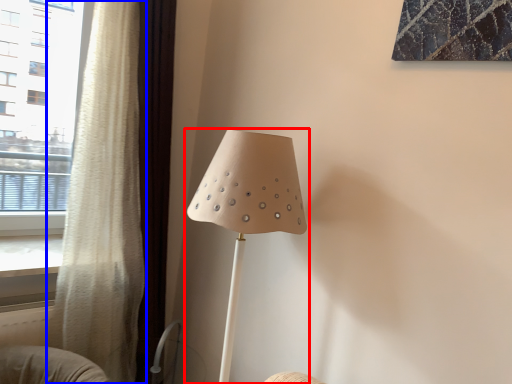
Question: Which point is closer to the camera, lamp (highlighted by a red box) or curtain (highlighted by a blue box)?

Choices:
 (A) lamp
 (B) curtain

Answer: (A)